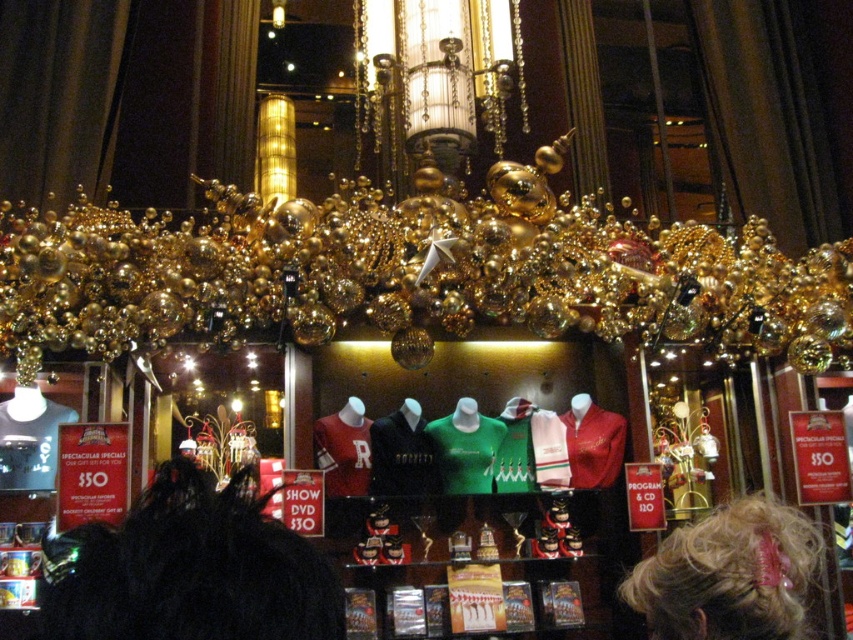
Question: Is blonde hair at upper right below matte red jersey at center?

Choices:
 (A) no
 (B) yes

Answer: (B)

Question: Which point is closer to the camera?

Choices:
 (A) (347, 428)
 (B) (117, 605)

Answer: (B)

Question: Can you confirm if black fur coat at center is positioned to the left of blonde hair at upper right?

Choices:
 (A) no
 (B) yes

Answer: (B)

Question: Which of these objects is positioned farthest from the black fur coat at center?

Choices:
 (A) green jersey at center
 (B) matte red jersey at center
 (C) blonde hair at upper right

Answer: (A)

Question: Which point is closer to the camera?

Choices:
 (A) blonde hair at upper right
 (B) matte red jersey at center
 (C) black fur coat at center
 (D) green jersey at center

Answer: (C)

Question: Does black fur coat at center have a lesser width compared to green jersey at center?

Choices:
 (A) yes
 (B) no

Answer: (B)